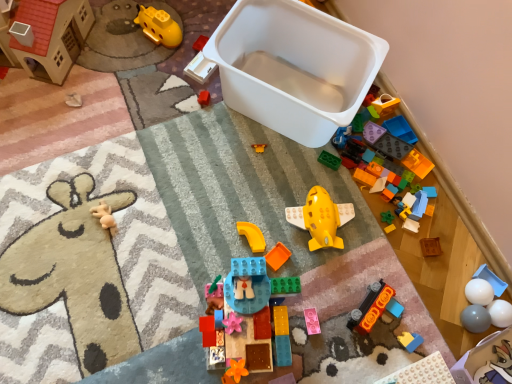
Where is `free location to the right of cardboard house at upper left, the 1th toy positioned from the left`? free location to the right of cardboard house at upper left, the 1th toy positioned from the left is located at coordinates (111, 71).